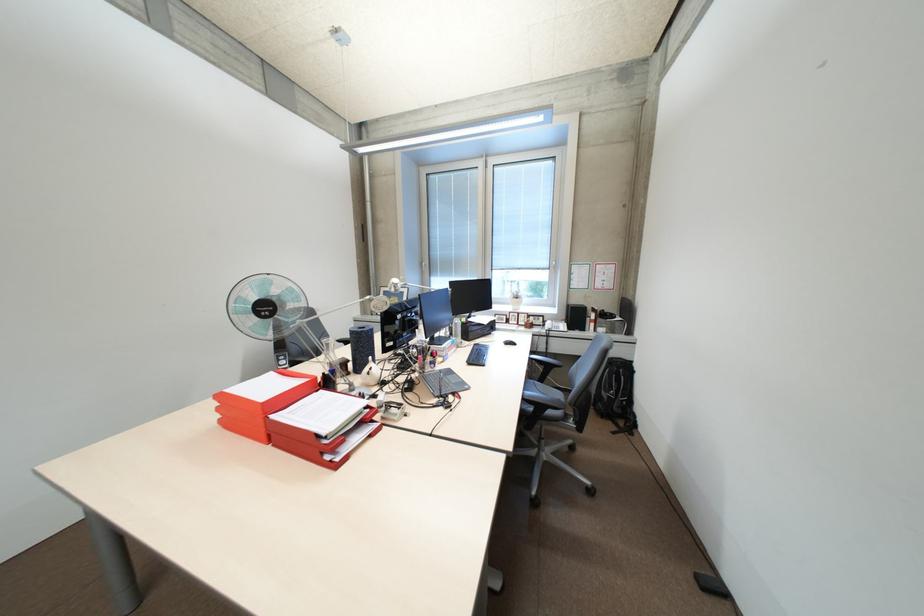
Which object does [261,400] point to?

This point indicates the red paper tray.